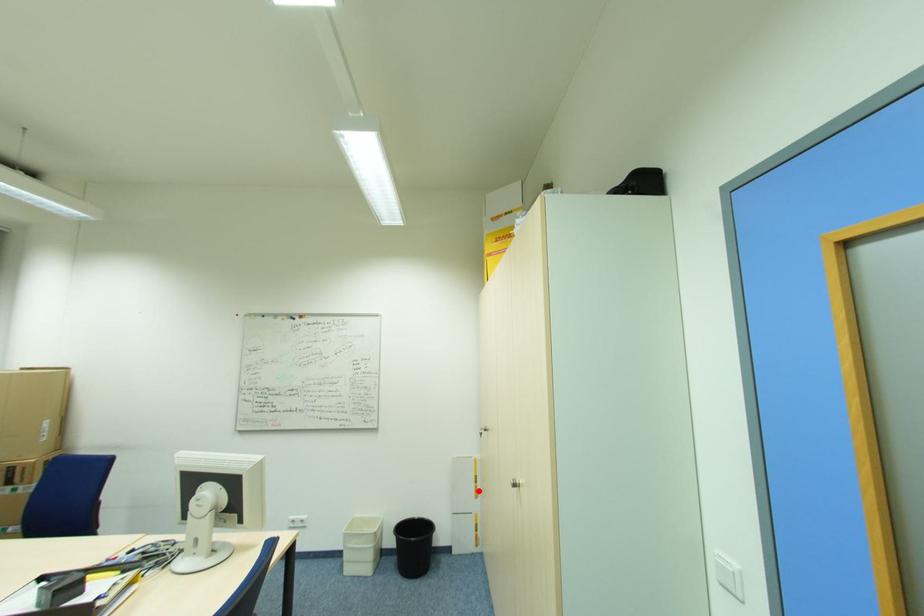
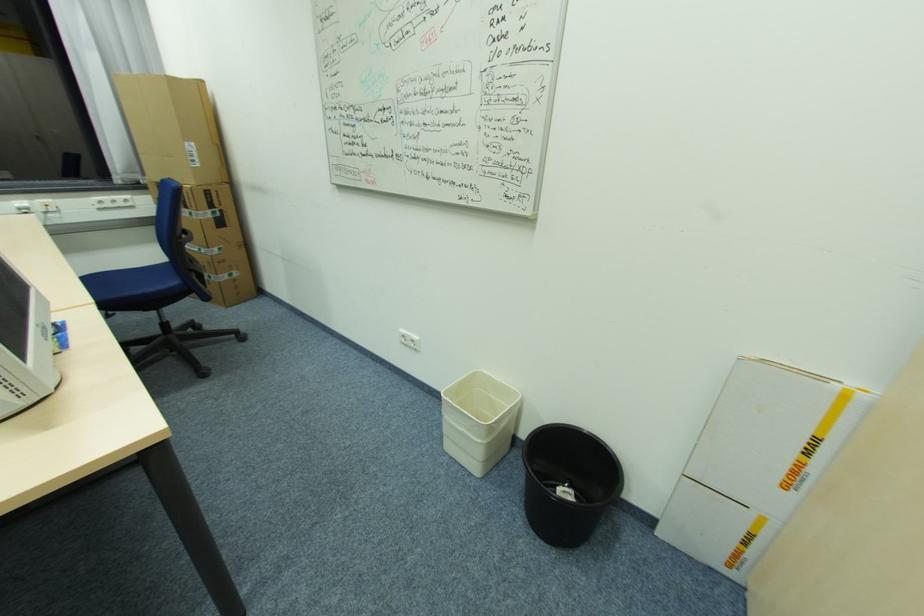
In the second image, find the point that corresponds to the highlighted location in the first image.

(797, 472)